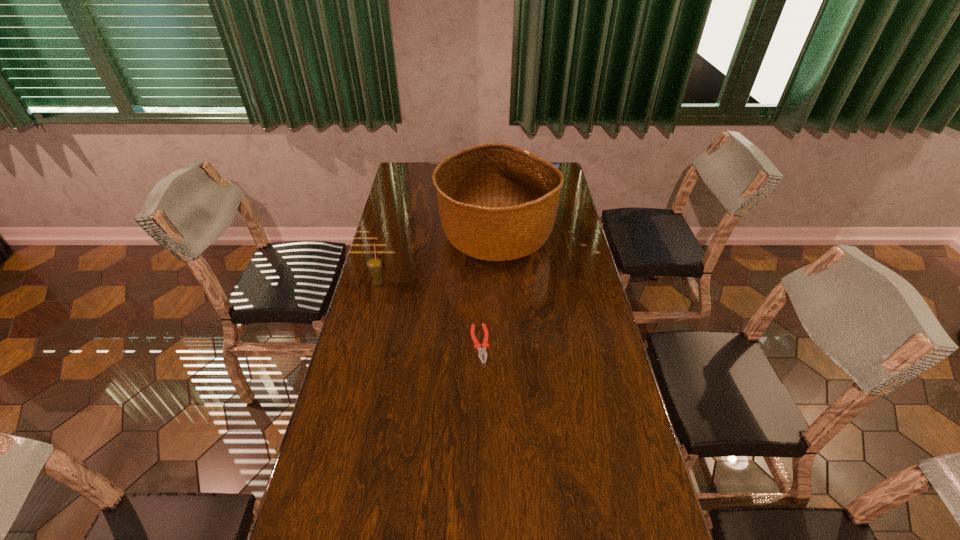
Where is `the tallest object`? The width and height of the screenshot is (960, 540). the tallest object is located at coordinates (497, 202).

You are a GUI agent. You are given a task and a screenshot of the screen. Output one action in this format:
    pyautogui.click(x=<x>, y=<y>)
    Task: Click on the farthest object
    The image size is (960, 540).
    Given the screenshot: What is the action you would take?
    pyautogui.click(x=497, y=202)

Where is `the leftmost object`? The height and width of the screenshot is (540, 960). the leftmost object is located at coordinates (374, 264).

The image size is (960, 540). I want to click on straw for drinking, so click(x=374, y=264).

Locate an element on the screen. This screenshot has height=540, width=960. pliers is located at coordinates (482, 351).

The image size is (960, 540). Find the location of `the shortest object`. the shortest object is located at coordinates (482, 351).

This screenshot has width=960, height=540. Identify the location of vacant position located on the back of the farthest object. (494, 193).

Identify the location of free space located 0.300m on the back of the second tallest object. (392, 230).

Locate an element on the screen. Image resolution: width=960 pixels, height=540 pixels. blank space located on the right of the nearest object is located at coordinates (581, 344).

Locate an element on the screen. This screenshot has height=540, width=960. object present at the left edge is located at coordinates (374, 264).